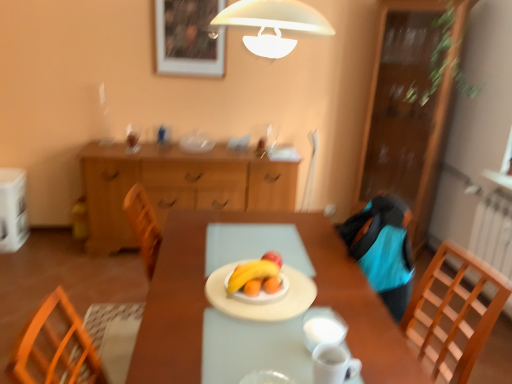
Find the location of a particular element. vacant area that lies in front of white matte plate at center, which is the fourth tableware in front-to-back order is located at coordinates (238, 347).